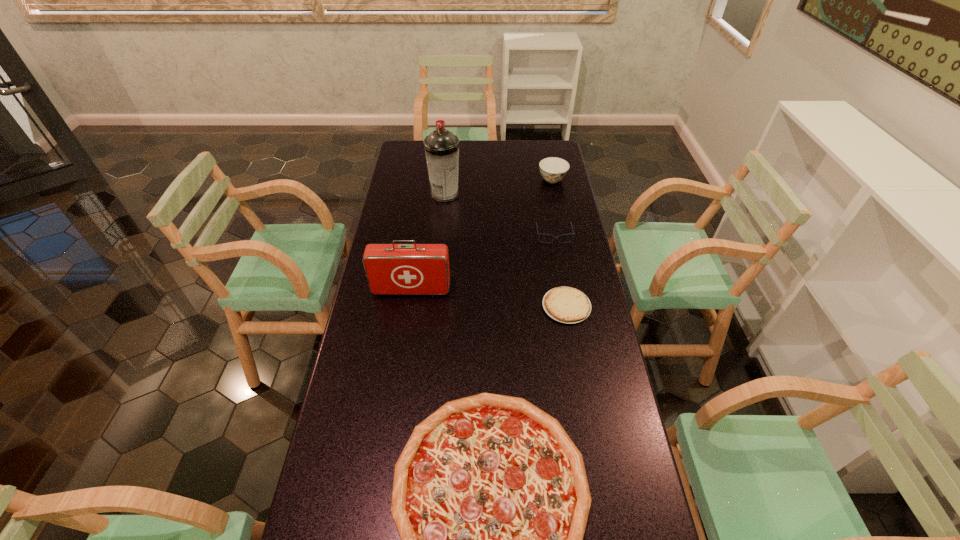
You are a GUI agent. You are given a task and a screenshot of the screen. Output one action in this format:
    pyautogui.click(x=<x>, y=<y>)
    Task: Click on the vacant space located 0.120m on the back of the tortilla
    This screenshot has width=960, height=540.
    Given the screenshot: What is the action you would take?
    pyautogui.click(x=559, y=264)

Locate an element on the screen. object present at the left edge is located at coordinates (391, 269).

I want to click on soup bowl at the right edge, so click(x=553, y=169).

Where is `spectacles at the right edge`? spectacles at the right edge is located at coordinates (538, 234).

The height and width of the screenshot is (540, 960). Identify the location of tortilla present at the right edge. (568, 305).

Find the location of a particular element. free space at the left edge is located at coordinates (370, 481).

Where is `free region at the right edge of the desktop`? free region at the right edge of the desktop is located at coordinates (568, 265).

The height and width of the screenshot is (540, 960). I want to click on free location at the far right corner, so click(559, 145).

Find the location of a particular element. vacant area that lies between the third tallest object and the second tallest object is located at coordinates (482, 235).

Where is `empty location between the soup bowl and the first-aid kit`? This screenshot has width=960, height=540. empty location between the soup bowl and the first-aid kit is located at coordinates (482, 235).